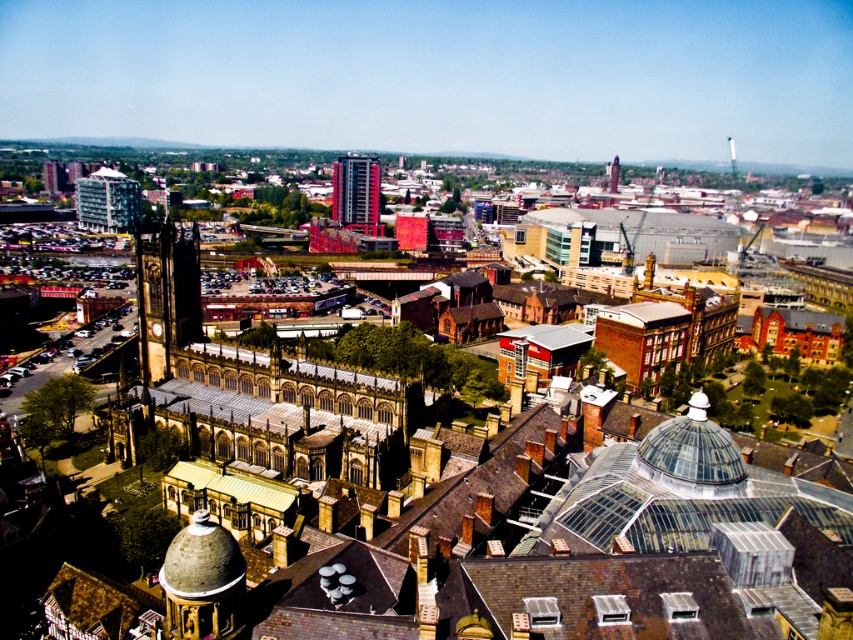
You are a drone operator tasked with capturing aerial shots of the city. Your client wants a closeup of the red glass tower at center. Given the coordinates provided, can you confirm if the point marked at point (357,193) is the correct location for the red glass tower at center?

Yes, the point (357,193) marks the red glass tower at center, so the drone should fly to that coordinate to capture the closeup.

You are a city planner assessing the distance between two prominent towers in the city. The red glass tower at center and the brick tower at center are both key landmarks. Given that the minimum required distance between such structures for safety regulations is 150 meters, can you confirm if they comply with the regulations?

The red glass tower at center and the brick tower at center are 175.90 meters apart, which exceeds the 150 meters safety regulation requirement, so they comply with the regulations.

You are a city planner reviewing this aerial view. You need to determine the spatial relationship between the matte glass building at left and the brick tower at center. Which one is positioned to the left?

The matte glass building at left is positioned to the left of the brick tower at center according to the description.